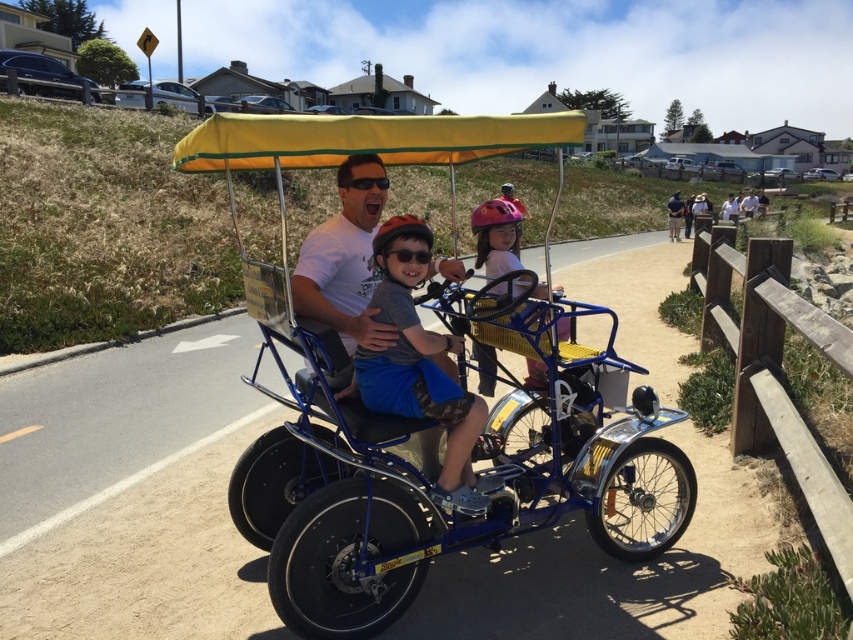
Question: Among these points, which one is farthest from the camera?

Choices:
 (A) (405, 291)
 (B) (514, 227)
 (C) (520, 285)

Answer: (B)

Question: Which point is farther from the camera taking this photo?

Choices:
 (A) (422, 234)
 (B) (347, 196)
 (C) (456, 401)
 (D) (506, 228)

Answer: (D)

Question: Is matte blue shorts at center to the right of pink matte helmet at center from the viewer's perspective?

Choices:
 (A) yes
 (B) no

Answer: (B)

Question: Can you confirm if matte blue shorts at center is thinner than pink matte helmet at center?

Choices:
 (A) yes
 (B) no

Answer: (B)

Question: Can you confirm if matte blue shorts at center is wider than matte blue tricycle at center?

Choices:
 (A) yes
 (B) no

Answer: (A)

Question: Among these points, which one is farthest from the camera?

Choices:
 (A) coord(367,211)
 (B) coord(444,532)
 (C) coord(515,268)

Answer: (C)